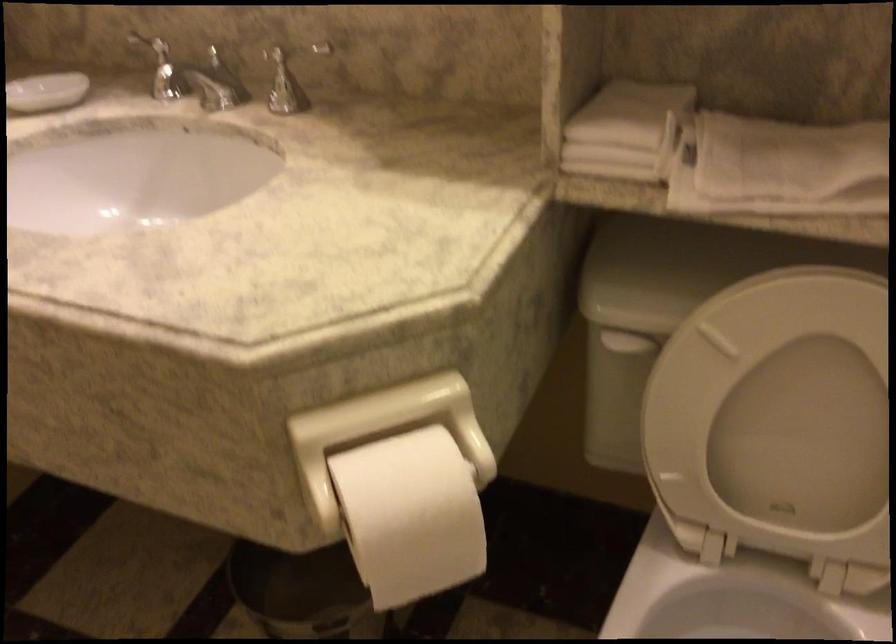
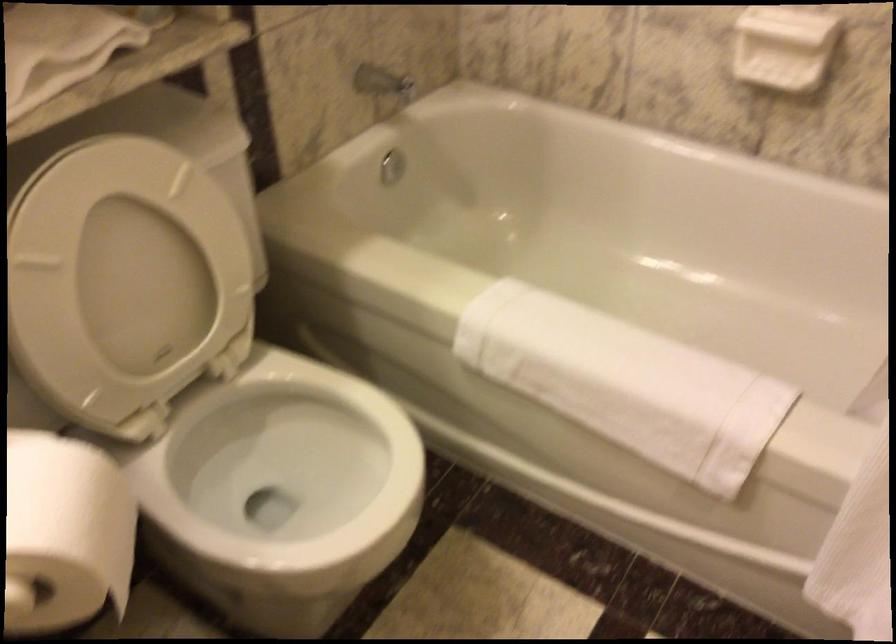
Based on the continuous images, in which direction is the camera rotating?

The camera's rotation is toward right-down.